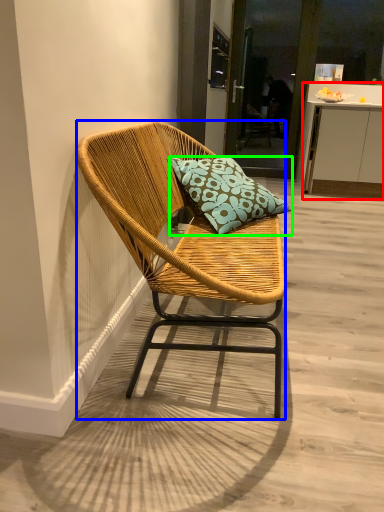
Question: Which object is positioned farthest from cabinetry (highlighted by a red box)? Select from chair (highlighted by a blue box) and pillow (highlighted by a green box).

Choices:
 (A) chair
 (B) pillow

Answer: (A)